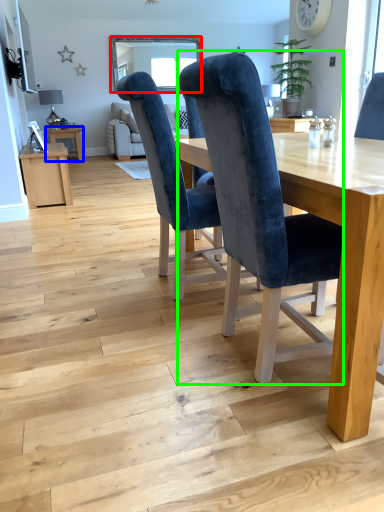
Question: Based on their relative distances, which object is farther from window screen (highlighted by a red box)? Choose from table (highlighted by a blue box) and chair (highlighted by a green box).

Choices:
 (A) table
 (B) chair

Answer: (B)